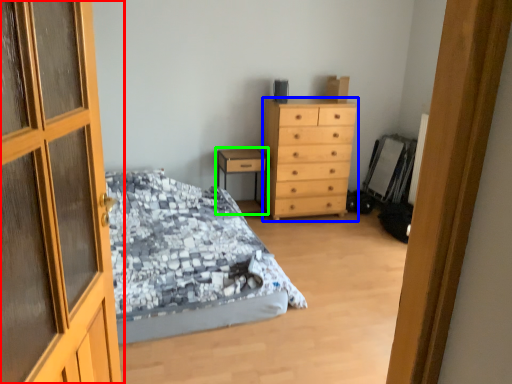
Question: Which object is positioned farthest from door (highlighted by a red box)? Select from chest of drawers (highlighted by a blue box) and nightstand (highlighted by a green box).

Choices:
 (A) chest of drawers
 (B) nightstand

Answer: (B)